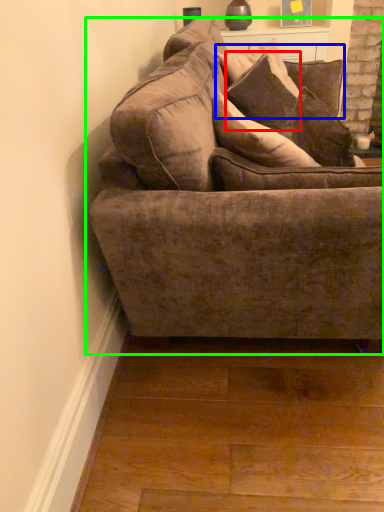
Question: Considering the real-world distances, which object is farthest from pillow (highlighted by a red box)? pillow (highlighted by a blue box) or studio couch (highlighted by a green box)?

Choices:
 (A) pillow
 (B) studio couch

Answer: (B)